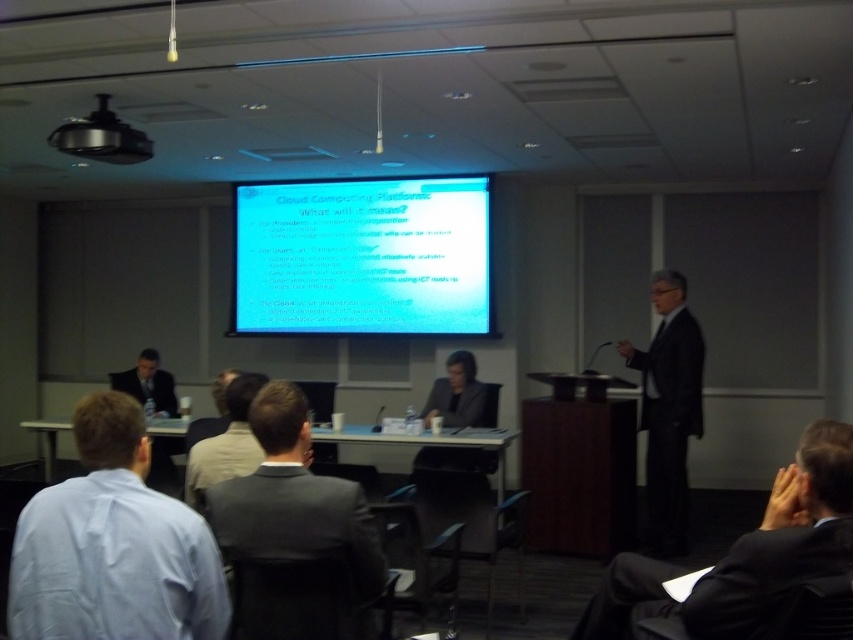
You are an event planner setting up a conference room. You need to ensure that the black plastic projector at upper center is visible to all attendees. Considering its height relative to the light brown suit at center, is the projector placed high enough?

The black plastic projector at upper center has a lesser height compared to the light brown suit at center. This means the projector is lower than the light brown suit, so it might not be visible to all attendees if the suit wearer is seated or standing in a position that blocks the view. Adjust the projector height to be higher than the light brown suit at center for better visibility.

You are an event organizer and need to ensure that the dark suit at lower right and the light brown shirt at center are visible to all attendees. Considering their sizes, which one might require a closer seat for better visibility?

The dark suit at lower right is bigger than the light brown shirt at center, so the light brown shirt at center might require a closer seat for better visibility to ensure it is seen clearly by all attendees.